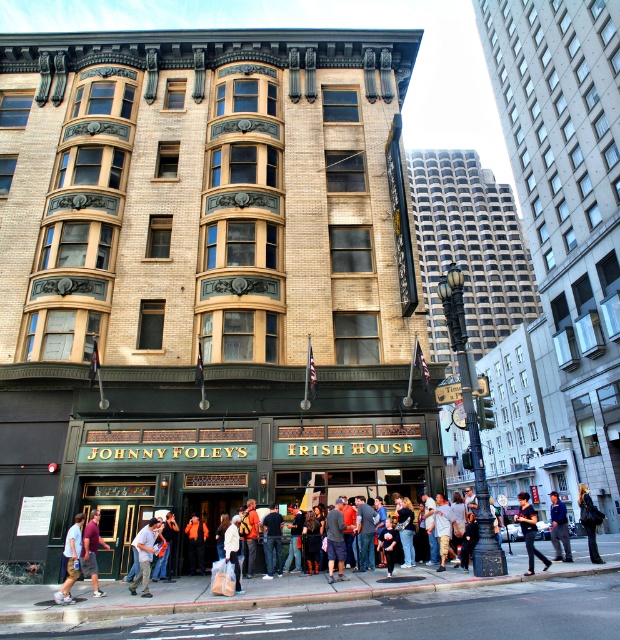
Who is positioned more to the right, maroon shirt at center or dark blue jeans at center?

From the viewer's perspective, dark blue jeans at center appears more on the right side.

Who is more forward, (84, 529) or (551, 524)?

Positioned in front is point (84, 529).

Find the location of `maroon shirt at center`. maroon shirt at center is located at coordinates (91, 552).

Is dark gray pants at center to the left of dark blue jeans at center from the viewer's perspective?

Correct, you'll find dark gray pants at center to the left of dark blue jeans at center.

Identify the location of dark gray pants at center. The width and height of the screenshot is (620, 640). (528, 531).

Which is in front, point (143, 538) or point (596, 557)?

Point (596, 557)

Does orange safety vest at lower center lie behind black leather jacket at center?

No, orange safety vest at lower center is closer to the viewer.

Which is behind, point (151, 540) or point (591, 545)?

Positioned behind is point (151, 540).

You are a GUI agent. You are given a task and a screenshot of the screen. Output one action in this format:
    pyautogui.click(x=<x>, y=<y>)
    Task: Click on the orange safety vest at lower center
    
    Given the screenshot: What is the action you would take?
    [x=144, y=556]